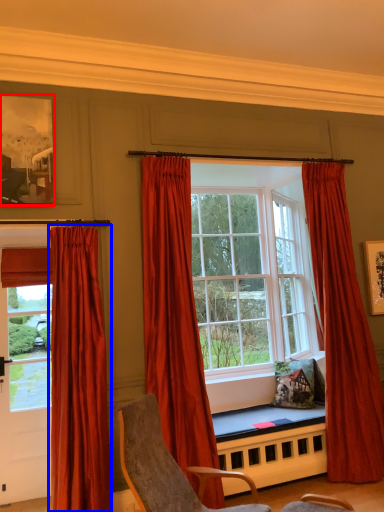
Question: Among these objects, which one is nearest to the camera, picture frame (highlighted by a red box) or curtain (highlighted by a blue box)?

Choices:
 (A) picture frame
 (B) curtain

Answer: (B)